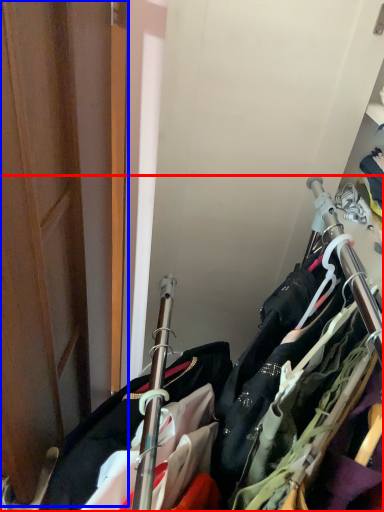
Question: Which point is further to the camera, closet (highlighted by a red box) or door (highlighted by a blue box)?

Choices:
 (A) closet
 (B) door

Answer: (A)